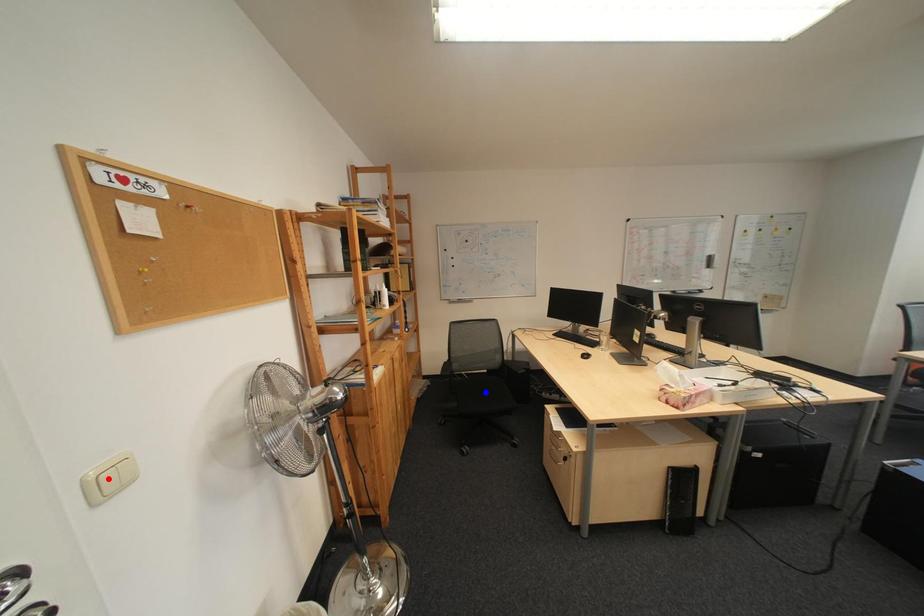
Question: Which of the two points in the image is closer to the camera?

Choices:
 (A) Blue point is closer.
 (B) Red point is closer.

Answer: (B)